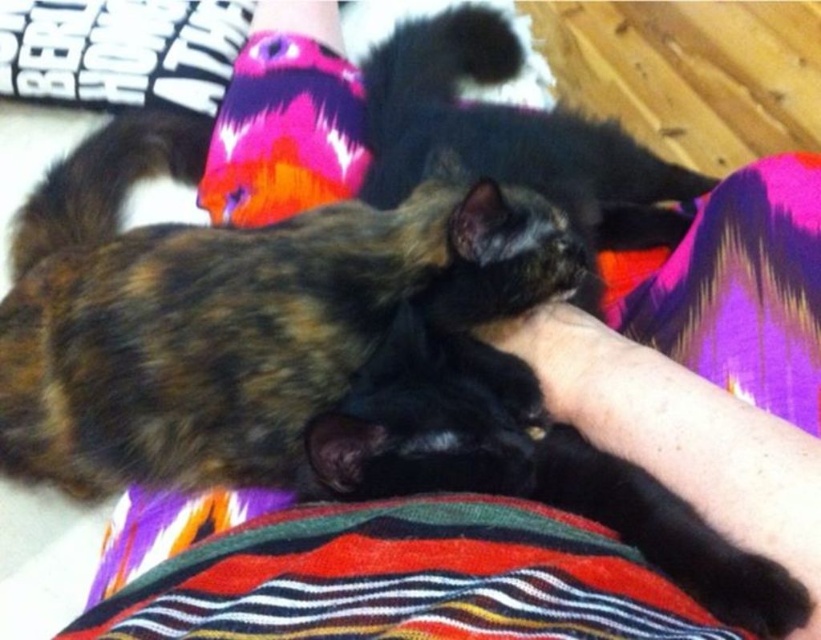
Question: Observing the image, what is the correct spatial positioning of brown tortoiseshell cat at center in reference to multicolored knitted sock at upper center?

Choices:
 (A) right
 (B) left

Answer: (B)

Question: Which point is closer to the camera?

Choices:
 (A) (138, 262)
 (B) (239, 64)

Answer: (A)

Question: Which point appears farthest from the camera in this image?

Choices:
 (A) (329, 115)
 (B) (400, 230)

Answer: (A)

Question: Does brown tortoiseshell cat at center have a greater width compared to multicolored knitted sock at upper center?

Choices:
 (A) yes
 (B) no

Answer: (A)

Question: Can you confirm if brown tortoiseshell cat at center is positioned above multicolored knitted sock at upper center?

Choices:
 (A) yes
 (B) no

Answer: (B)

Question: Which point appears farthest from the camera in this image?

Choices:
 (A) (282, 36)
 (B) (450, 225)

Answer: (A)